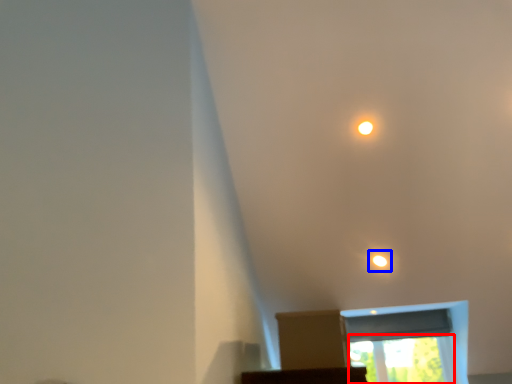
Question: Which point is further to the camera, window screen (highlighted by a red box) or light (highlighted by a blue box)?

Choices:
 (A) window screen
 (B) light

Answer: (A)